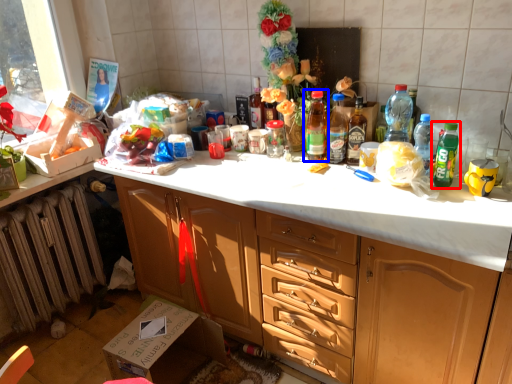
Question: Which object is closer to the camera taking this photo, bottle (highlighted by a red box) or bottle (highlighted by a blue box)?

Choices:
 (A) bottle
 (B) bottle

Answer: (A)